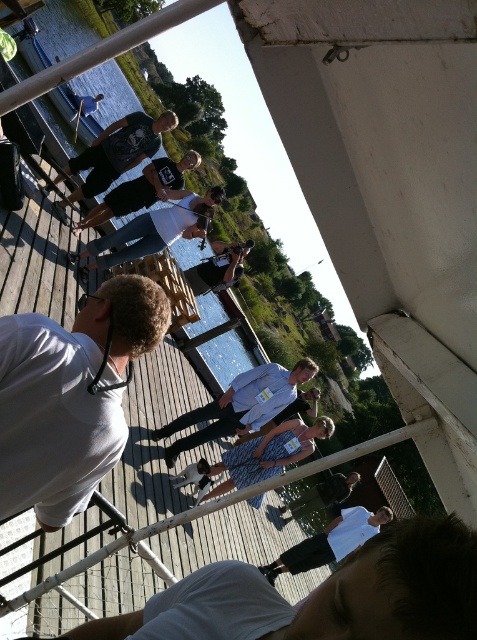
Measure the distance between patterned fabric dress at center and camera.

patterned fabric dress at center is 26.07 feet from camera.

The height and width of the screenshot is (640, 477). Identify the location of patterned fabric dress at center. (268, 452).

Consider the image. Which is below, white matte shirt at center or patterned fabric dress at center?

patterned fabric dress at center

Can you confirm if white matte shirt at center is bigger than patterned fabric dress at center?

Correct, white matte shirt at center is larger in size than patterned fabric dress at center.

Measure the distance between point [137,250] and camera.

The distance of point [137,250] from camera is 9.30 meters.

Find the location of `white matte shirt at center`. white matte shirt at center is located at coordinates (153, 228).

Is point (26, 506) positioned after point (269, 580)?

No, it is in front of (269, 580).

This screenshot has width=477, height=640. What do you see at coordinates (70, 396) in the screenshot?
I see `white matte shirt at lower left` at bounding box center [70, 396].

Between point (20, 435) and point (354, 509), which one is positioned in front?

Point (20, 435) is in front.

The height and width of the screenshot is (640, 477). In order to click on white matte shirt at lower left in this screenshot , I will do `click(70, 396)`.